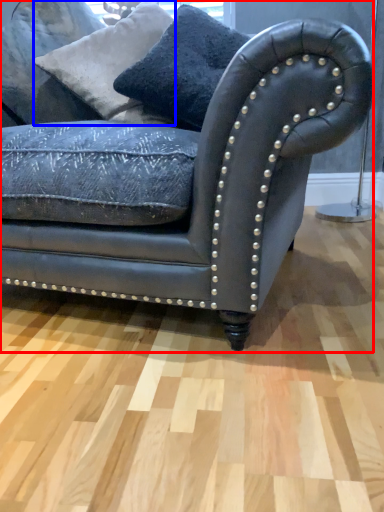
Question: Which of the following is the closest to the observer, studio couch (highlighted by a red box) or pillow (highlighted by a blue box)?

Choices:
 (A) studio couch
 (B) pillow

Answer: (A)